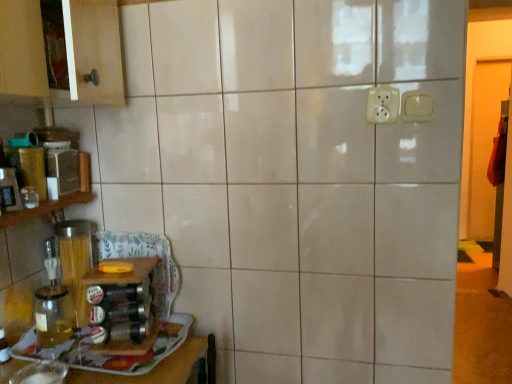
Locate an element on the screen. The width and height of the screenshot is (512, 384). vacant area that is in front of transparent glass jar at left is located at coordinates (45, 354).